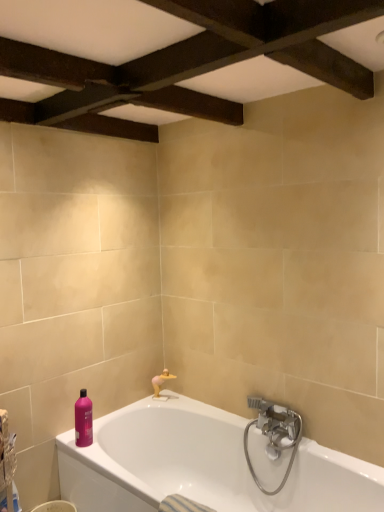
Question: Is plastic woven basket at lower left situated inside pink glossy bottle at lower left or outside?

Choices:
 (A) outside
 (B) inside

Answer: (A)

Question: From a real-world perspective, relative to pink glossy bottle at lower left, is plastic woven basket at lower left vertically above or below?

Choices:
 (A) above
 (B) below

Answer: (A)

Question: Considering the real-world distances, which object is closest to the plastic woven basket at lower left?

Choices:
 (A) satin nickel faucet at lower right
 (B) white glossy bathtub at lower center
 (C) pink glossy bottle at lower left
 (D) matte gold faucet at lower center

Answer: (C)

Question: Which object is the farthest from the plastic woven basket at lower left?

Choices:
 (A) satin nickel faucet at lower right
 (B) white glossy bathtub at lower center
 (C) pink glossy bottle at lower left
 (D) matte gold faucet at lower center

Answer: (A)